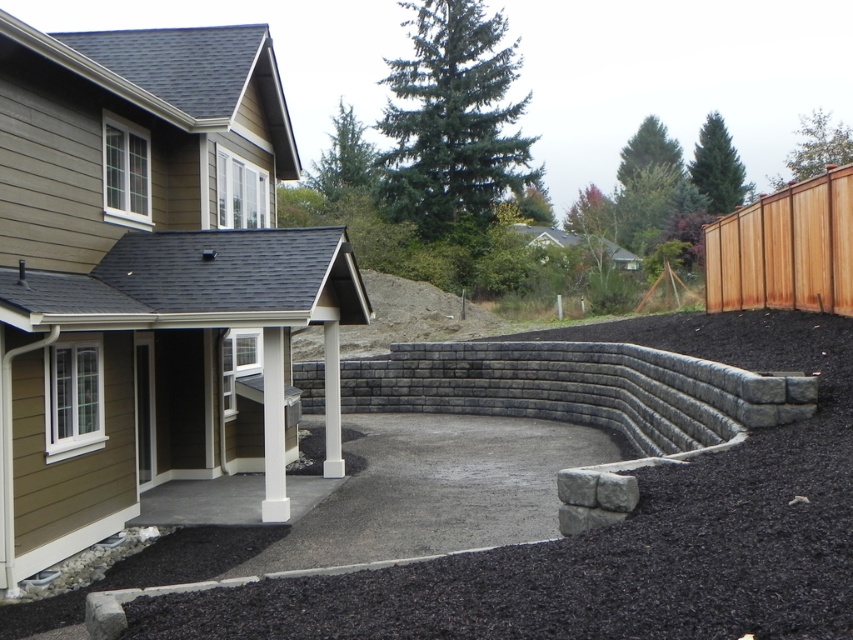
Question: Can you confirm if gray concrete patio at center is wider than black gravel at lower center?

Choices:
 (A) yes
 (B) no

Answer: (B)

Question: Which point is farther to the camera?

Choices:
 (A) brown wood fence at upper right
 (B) black gravel at lower center
 (C) gray concrete patio at center

Answer: (A)

Question: Which object appears farthest from the camera in this image?

Choices:
 (A) brown wood fence at upper right
 (B) black gravel at lower center
 (C) gray concrete patio at center

Answer: (A)

Question: Considering the real-world distances, which object is farthest from the brown wood fence at upper right?

Choices:
 (A) black gravel at lower center
 (B) gray concrete patio at center

Answer: (B)

Question: From the image, what is the correct spatial relationship of gray concrete patio at center in relation to brown wood fence at upper right?

Choices:
 (A) left
 (B) right

Answer: (A)

Question: Does gray concrete patio at center have a larger size compared to brown wood fence at upper right?

Choices:
 (A) yes
 (B) no

Answer: (A)